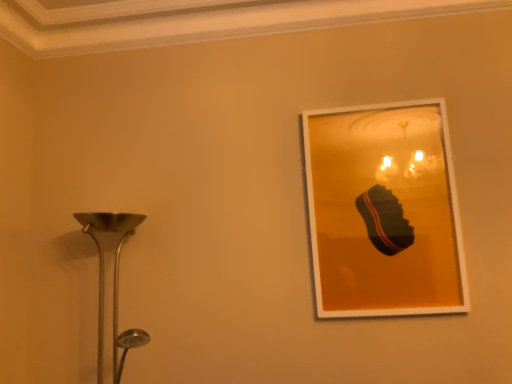
Identify the location of matte white picture frame at upper right. The image size is (512, 384). (384, 211).

What do you see at coordinates (384, 211) in the screenshot?
I see `matte white picture frame at upper right` at bounding box center [384, 211].

What do you see at coordinates (113, 282) in the screenshot?
I see `polished silver lamp at left` at bounding box center [113, 282].

I want to click on polished silver lamp at left, so click(113, 282).

Image resolution: width=512 pixels, height=384 pixels. I want to click on matte white picture frame at upper right, so click(384, 211).

Between polished silver lamp at left and matte white picture frame at upper right, which one appears on the left side from the viewer's perspective?

Positioned to the left is polished silver lamp at left.

Which object is further away from the camera, polished silver lamp at left or matte white picture frame at upper right?

Positioned behind is matte white picture frame at upper right.

Which is farther from the camera, [87,223] or [394,263]?

The point [394,263] is farther from the camera.

From the image's perspective, relative to matte white picture frame at upper right, is polished silver lamp at left above or below?

Clearly, from the image's perspective, polished silver lamp at left is below matte white picture frame at upper right.

From a real-world perspective, who is located higher, polished silver lamp at left or matte white picture frame at upper right?

In real-world perspective, matte white picture frame at upper right is above.

Which object is thinner, polished silver lamp at left or matte white picture frame at upper right?

matte white picture frame at upper right is thinner.

Considering the relative sizes of polished silver lamp at left and matte white picture frame at upper right in the image provided, is polished silver lamp at left taller than matte white picture frame at upper right?

No.

Considering the sizes of objects polished silver lamp at left and matte white picture frame at upper right in the image provided, who is bigger, polished silver lamp at left or matte white picture frame at upper right?

With larger size is polished silver lamp at left.

Is polished silver lamp at left situated inside matte white picture frame at upper right or outside?

polished silver lamp at left is located beyond the bounds of matte white picture frame at upper right.

Is polished silver lamp at left far from matte white picture frame at upper right?

They are positioned close to each other.

From the picture: Could you tell me if polished silver lamp at left is facing matte white picture frame at upper right?

No, polished silver lamp at left is not aimed at matte white picture frame at upper right.

At what (x,y) coordinates should I click in order to perform the action: click on picture frame that appears on the right of polished silver lamp at left. Please return your answer as a coordinate pair (x, y). Looking at the image, I should click on (384, 211).

Which object is positioned more to the right, matte white picture frame at upper right or polished silver lamp at left?

Positioned to the right is matte white picture frame at upper right.

Who is more distant, matte white picture frame at upper right or polished silver lamp at left?

matte white picture frame at upper right is behind.

Which point is more distant from viewer, (378, 130) or (93, 225)?

The point (378, 130) is farther.

From the image's perspective, between matte white picture frame at upper right and polished silver lamp at left, who is located below?

polished silver lamp at left is shown below in the image.

From a real-world perspective, who is located lower, matte white picture frame at upper right or polished silver lamp at left?

In real-world perspective, polished silver lamp at left is lower.

Between matte white picture frame at upper right and polished silver lamp at left, which one has larger width?

polished silver lamp at left.

Between matte white picture frame at upper right and polished silver lamp at left, which one has more height?

matte white picture frame at upper right is taller.

Considering the relative sizes of matte white picture frame at upper right and polished silver lamp at left in the image provided, is matte white picture frame at upper right smaller than polished silver lamp at left?

Indeed, matte white picture frame at upper right has a smaller size compared to polished silver lamp at left.

Choose the correct answer: Is matte white picture frame at upper right inside polished silver lamp at left or outside it?

matte white picture frame at upper right exists outside the volume of polished silver lamp at left.

Is the surface of matte white picture frame at upper right in direct contact with polished silver lamp at left?

No, matte white picture frame at upper right is not making contact with polished silver lamp at left.

Is matte white picture frame at upper right turned away from polished silver lamp at left?

No.

The image size is (512, 384). I want to click on lamp below the matte white picture frame at upper right (from a real-world perspective), so click(x=113, y=282).

The image size is (512, 384). I want to click on picture frame that appears behind the polished silver lamp at left, so click(384, 211).

Identify the location of picture frame above the polished silver lamp at left (from the image's perspective). Image resolution: width=512 pixels, height=384 pixels. coord(384,211).